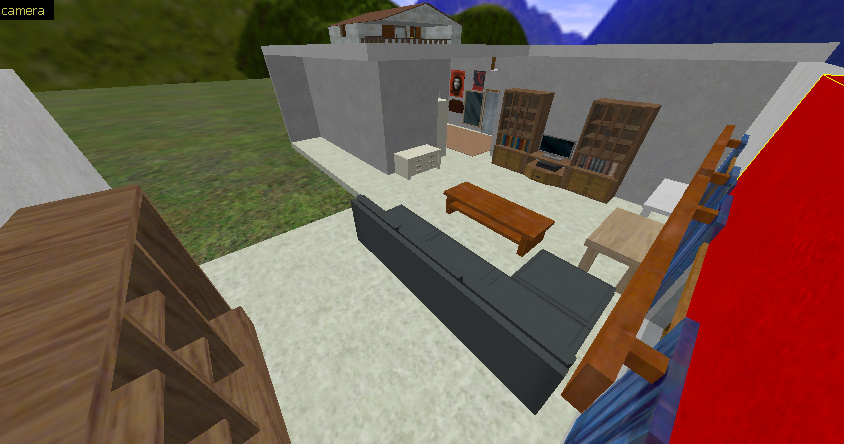
This screenshot has height=444, width=844. Identify the location of drawer. coord(597,190).